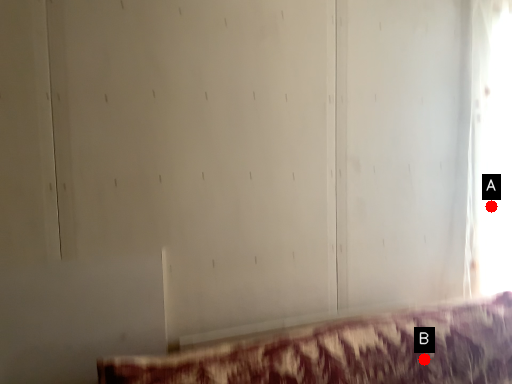
Question: Two points are circled on the image, labeled by A and B beside each circle. Which of the following is the closest to the observer?

Choices:
 (A) A is closer
 (B) B is closer

Answer: (B)